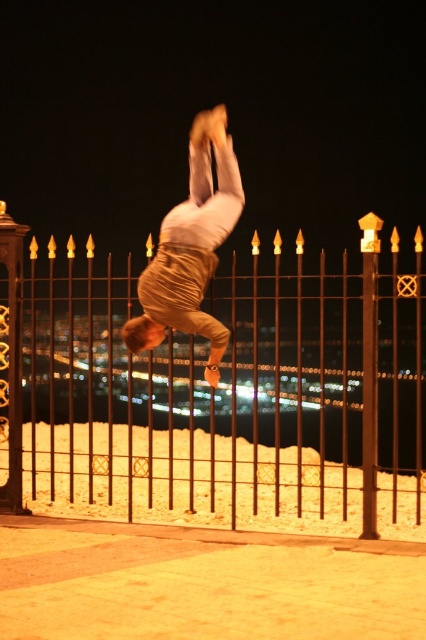
Based on the photo, is black wrought iron fence at center wider than golden fabric pants at center?

No, black wrought iron fence at center is not wider than golden fabric pants at center.

Between point (104, 337) and point (195, 150), which one is positioned in front?

Point (195, 150)

In order to click on black wrought iron fence at center in this screenshot , I will do `click(216, 394)`.

You are a GUI agent. You are given a task and a screenshot of the screen. Output one action in this format:
    pyautogui.click(x=<x>, y=<y>)
    Task: Click on the black wrought iron fence at center
    This screenshot has width=426, height=640.
    Given the screenshot: What is the action you would take?
    pyautogui.click(x=216, y=394)